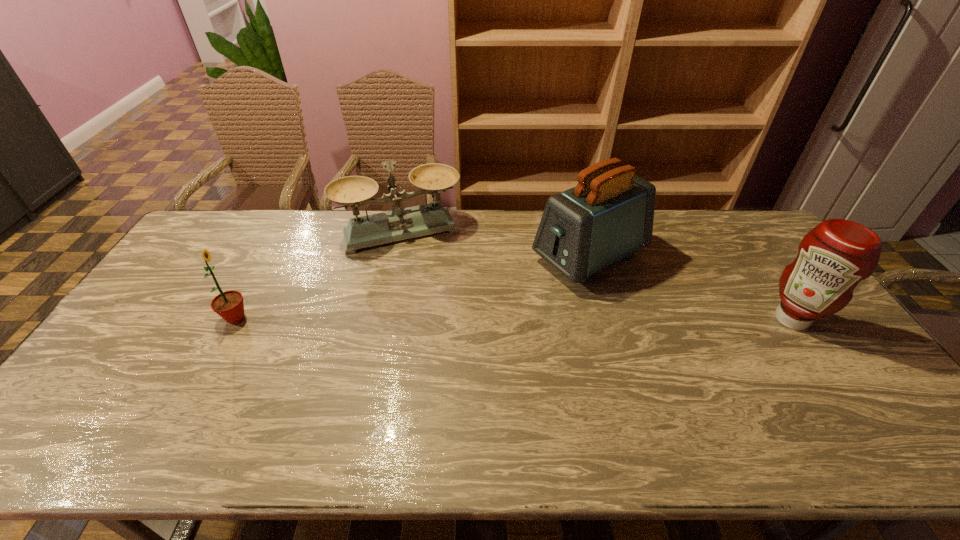
Image resolution: width=960 pixels, height=540 pixels. I want to click on vacant space situated 0.290m on the front-facing side of the third object from right to left, so click(x=440, y=314).

What are the coordinates of `vacant space located on the front-facing side of the third object from right to left` in the screenshot? It's located at (430, 289).

You are a GUI agent. You are given a task and a screenshot of the screen. Output one action in this format:
    pyautogui.click(x=<x>, y=<y>)
    Task: Click on the toaster located in the far edge section of the desktop
    
    Given the screenshot: What is the action you would take?
    pyautogui.click(x=608, y=216)

At what (x,y) coordinates should I click in order to perform the action: click on scale that is at the far edge. Please return your answer as a coordinate pair (x, y). This screenshot has width=960, height=540. Looking at the image, I should click on (355, 191).

Find the location of a particular element. This screenshot has height=540, width=960. object at the right edge is located at coordinates (837, 254).

In the image, there is a desktop. Where is `vacant space at the far edge`? This screenshot has height=540, width=960. vacant space at the far edge is located at coordinates (363, 209).

At what (x,y) coordinates should I click in order to perform the action: click on free location at the near edge. Please return your answer as a coordinate pair (x, y). This screenshot has height=540, width=960. Looking at the image, I should click on (220, 392).

Find the location of a particular element. This screenshot has height=540, width=960. vacant space at the left edge is located at coordinates (147, 359).

What are the coordinates of `vacant space at the right edge of the desktop` in the screenshot? It's located at (760, 292).

This screenshot has width=960, height=540. Find the location of `vacant area that lies between the toaster and the rightmost object`. vacant area that lies between the toaster and the rightmost object is located at coordinates (690, 288).